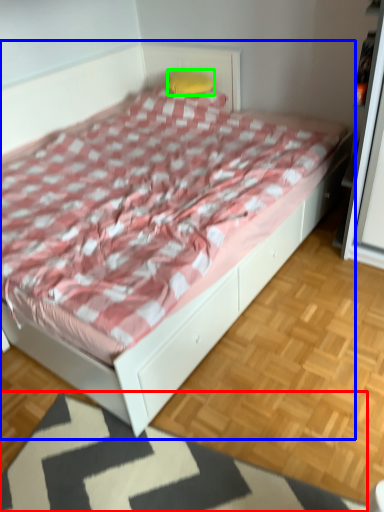
Question: Which object is the closest to the mat (highlighted by a red box)? Choose among these: bed (highlighted by a blue box) or pillow (highlighted by a green box).

Choices:
 (A) bed
 (B) pillow

Answer: (A)